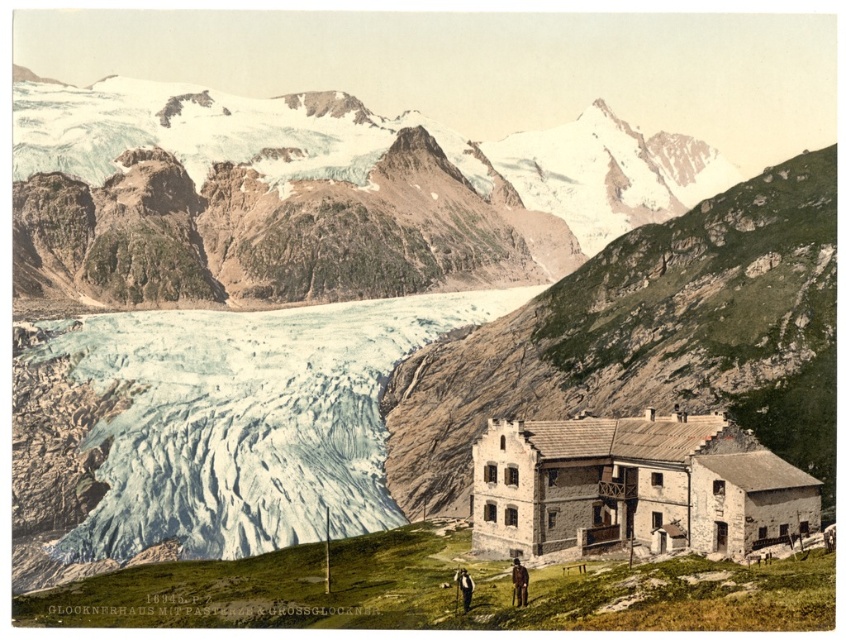
You are standing at the glacier and looking towards the mountain. There are two points marked in the image, point 1 at coordinates point (350, 209) and point 2 at coordinates point (523, 593). Which point is closer to you?

Point (350, 209) is closer to you because it is further to the viewer than point (523, 593).

In the mountain landscape scene, there is a stone textured building at center and a dark gray wool jacket at lower center. Which object is positioned to the right of the other?

The stone textured building at center is positioned to the right of the dark gray wool jacket at lower center.

You are planning to take a photo of the snowy rocky mountain at upper center and the brown leather jacket at lower right. Which object should you focus on first if you want to capture both in a single frame without moving the camera?

The snowy rocky mountain at upper center should be focused on first because it is wider than the brown leather jacket at lower right, so it requires more attention to fit both in the frame.